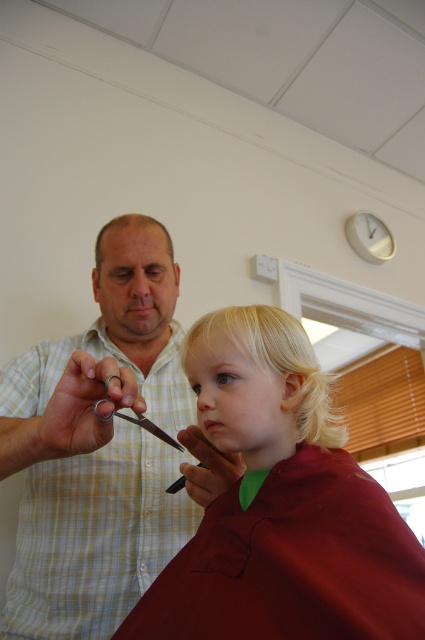
You are a customer entering the barbershop and see the checkered fabric shirt at upper left and the blonde silky hair at center. Which object is closer to the entrance of the barbershop?

The checkered fabric shirt at upper left is positioned under the blonde silky hair at center, so the checkered fabric shirt at upper left is closer to the entrance.

You are standing in a barbershop and want to get to the point marked as point [45,483]. If you can move 4 feet per second, how many seconds will it take you to reach the point?

The point [45,483] is 3.56 feet away from you, so it will take approximately 0.89 seconds to reach it since 3.56 divided by 4 equals 0.89.